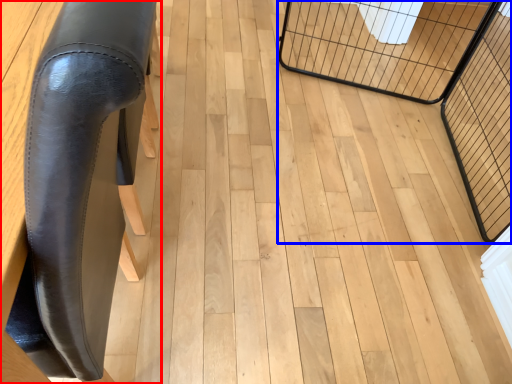
Question: Which object is closer to the camera taking this photo, furniture (highlighted by a red box) or cage (highlighted by a blue box)?

Choices:
 (A) furniture
 (B) cage

Answer: (A)